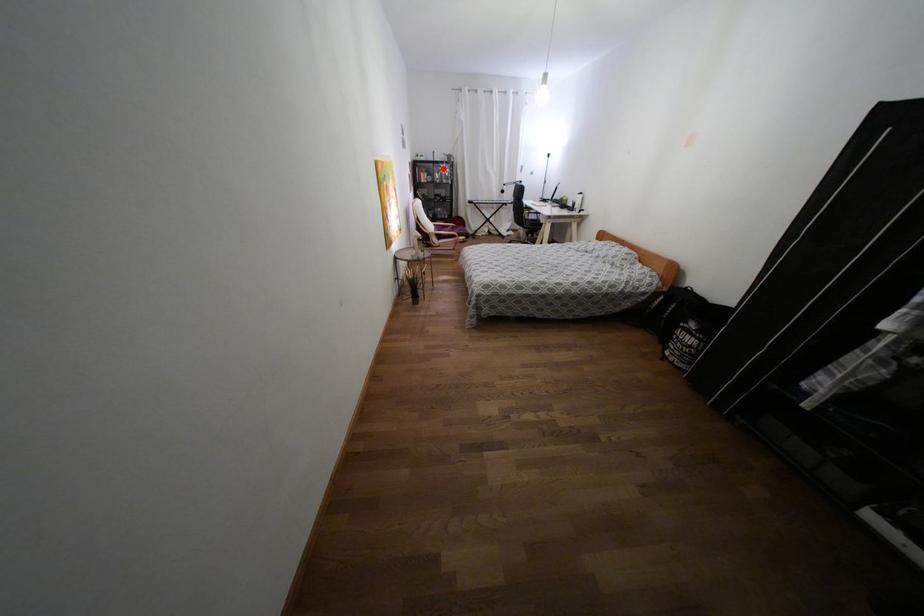
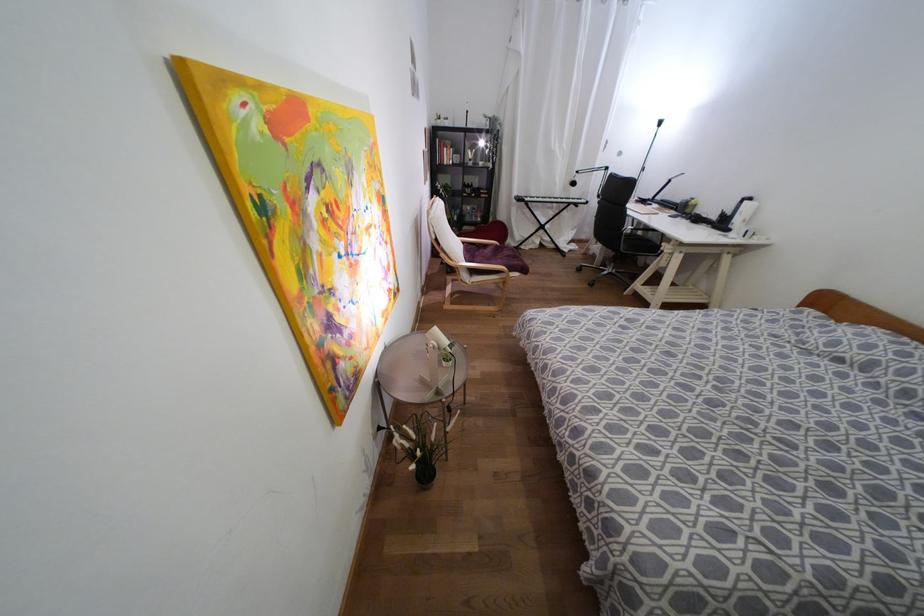
Question: A red point is marked in image1. In image2, is the corresponding 3D point closer to the camera or farther? Reply with the corresponding letter.

Choices:
 (A) The corresponding 3D point is closer.
 (B) The corresponding 3D point is farther.

Answer: (B)